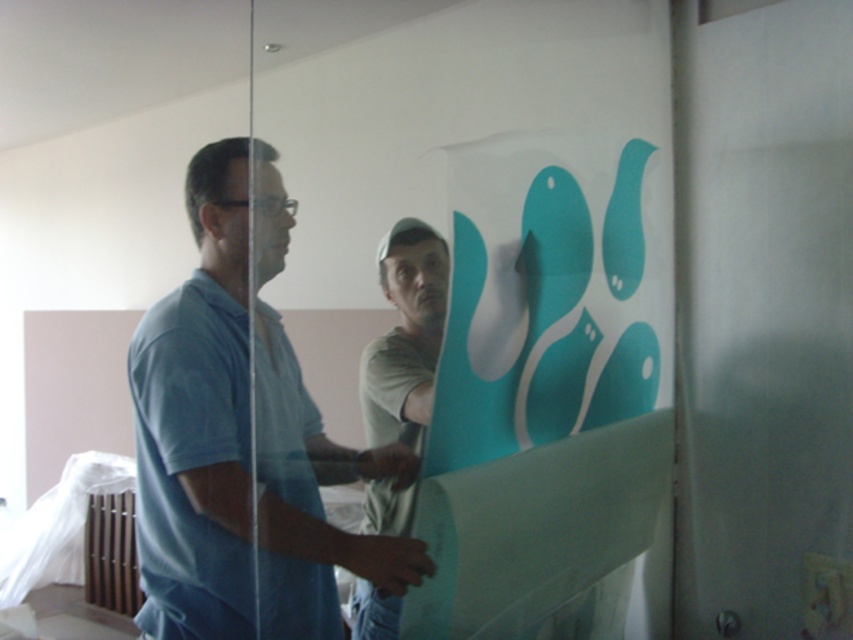
You are organizing a clothing donation drive and need to determine which item takes up more space between the blue cotton shirt at left and the light brown paper at center. Which item requires more storage space?

The blue cotton shirt at left has a larger size compared to the light brown paper at center, so it requires more storage space.

You are standing in a room with a transparent plastic glass door at center and a blue cotton shirt at left. You want to exit through the door. Which object should you move past first?

You should move past the blue cotton shirt at left first because the transparent plastic glass door at center is in front of it, meaning the shirt is behind the door and you need to approach the door first before reaching the shirt.

You are standing in the room and want to exit through the transparent plastic glass door at center. However, you notice a point marked at coordinates (x=471, y=164). Is this point on the transparent plastic glass door at center or somewhere else?

The point at coordinates (x=471, y=164) is on the transparent plastic glass door at center according to the description.